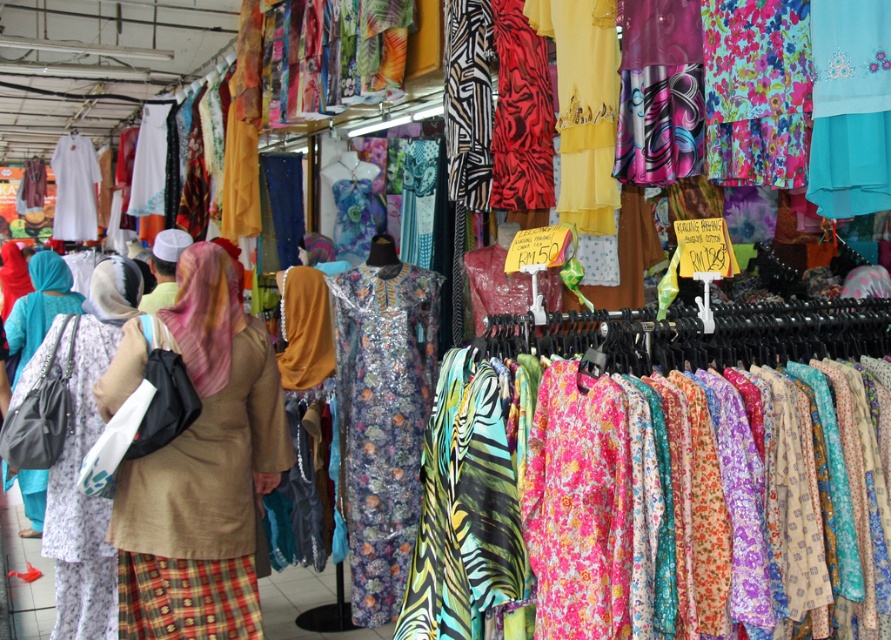
You are a photographer standing at the camera position. You want to take a photo of the beige fabric hijab at center. Can you reach it with your hand to adjust it before taking the photo?

The beige fabric hijab at center and camera are 3.04 meters apart, so no, you cannot reach it with your hand since the distance is too far.

Based on the photo, you are a customer in the store looking for a dress. You see the shiny floral dress at center and the white matte dress at left. Which dress is positioned to the right of the other?

The shiny floral dress at center is to the right of the white matte dress at left.